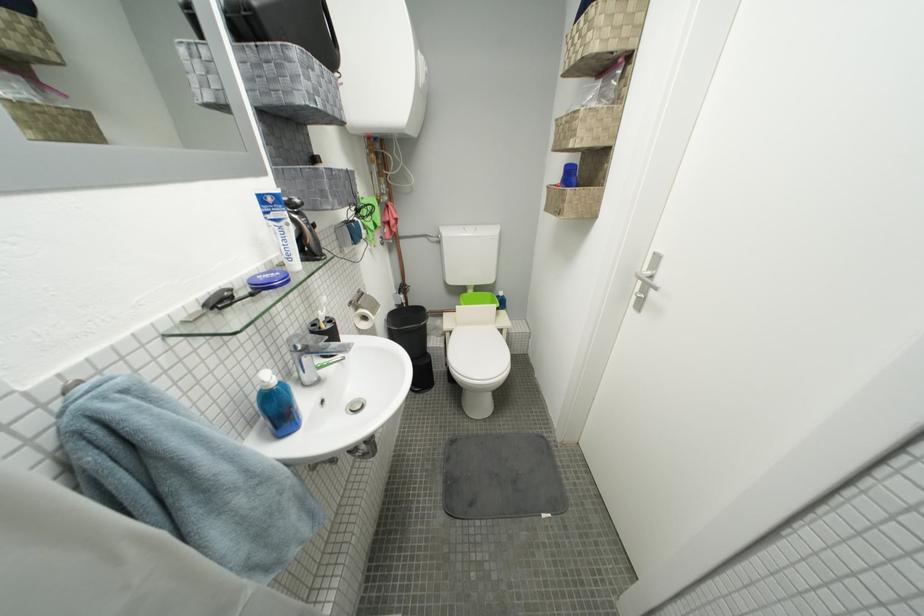
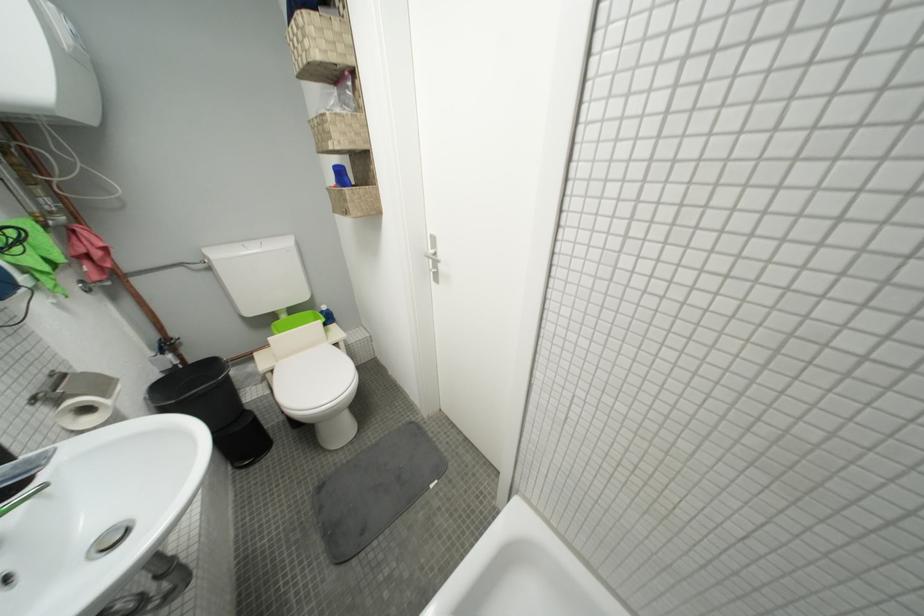
Question: The images are taken continuously from a first-person perspective. In which direction is your viewpoint rotating?

Choices:
 (A) Left
 (B) Right
 (C) Up
 (D) Down

Answer: (B)